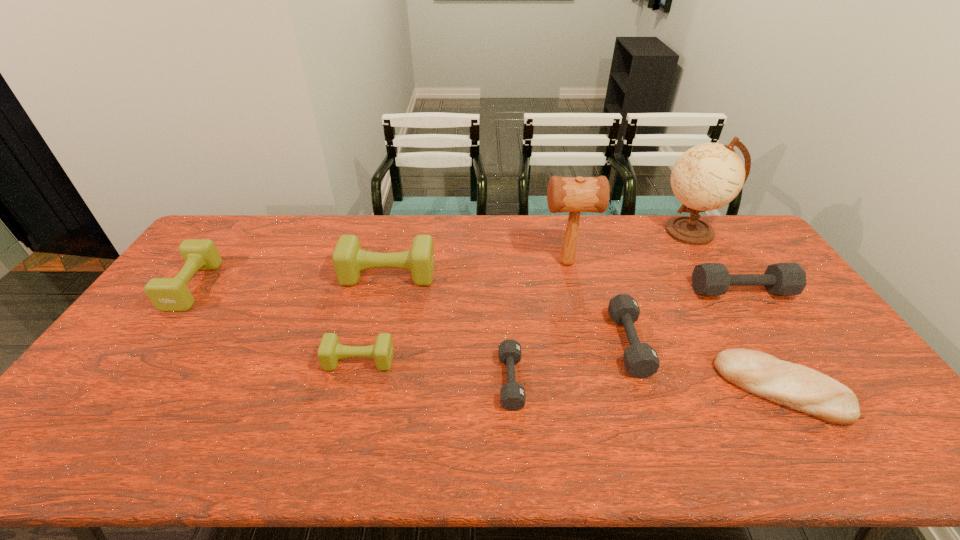
This screenshot has width=960, height=540. In the image, there is a desktop. Find the location of `free space at the right edge`. free space at the right edge is located at coordinates (768, 306).

Identify the location of vacant space at the far right corner of the desktop. (716, 215).

The width and height of the screenshot is (960, 540). In the image, there is a desktop. Identify the location of free region at the near right corner. (874, 458).

In order to click on free space between the smallest olive dumbbell and the farthest gray dumbbell in this screenshot , I will do `click(550, 326)`.

Image resolution: width=960 pixels, height=540 pixels. Find the location of `free space between the globe and the fifth dumbbell from left to right`. free space between the globe and the fifth dumbbell from left to right is located at coordinates (660, 287).

Where is `empty space that is in between the beige globe and the second gray dumbbell from left to right`? This screenshot has height=540, width=960. empty space that is in between the beige globe and the second gray dumbbell from left to right is located at coordinates (660, 287).

Find the location of a particular element. free space between the bread and the beige globe is located at coordinates (736, 310).

Where is `empty space between the leftmost object and the mallet`? This screenshot has width=960, height=540. empty space between the leftmost object and the mallet is located at coordinates (380, 274).

This screenshot has width=960, height=540. Identify the location of free space that is in between the second smallest gray dumbbell and the mallet. (598, 303).

Locate an element on the screen. The image size is (960, 540). free spot between the tallest dumbbell and the fifth dumbbell from left to right is located at coordinates (509, 309).